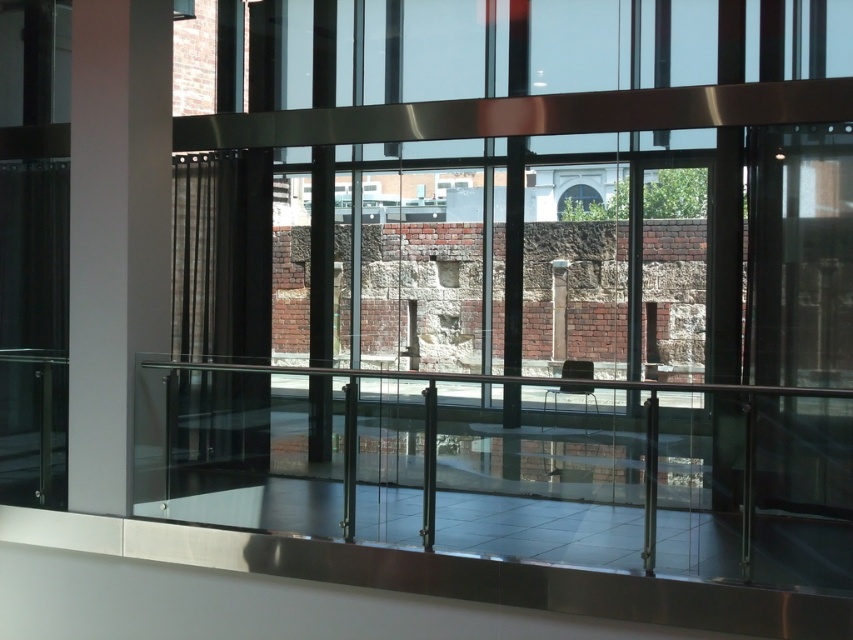
Who is higher up, clear glass railing at center or white glossy pillar at left?

white glossy pillar at left is above.

Between point (840, 499) and point (93, 371), which one is positioned behind?

Positioned behind is point (840, 499).

Identify the location of clear glass railing at center. This screenshot has width=853, height=640. (509, 467).

Does white glossy pillar at left have a smaller size compared to smooth stone pillar at center?

Actually, white glossy pillar at left might be larger than smooth stone pillar at center.

Who is lower down, white glossy pillar at left or smooth stone pillar at center?

smooth stone pillar at center

Locate an element on the screen. white glossy pillar at left is located at coordinates (115, 234).

Is the position of clear glass railing at center more distant than that of smooth stone pillar at center?

No, it is in front of smooth stone pillar at center.

Between point (386, 477) and point (554, 340), which one is positioned in front?

Point (386, 477)

You are a GUI agent. You are given a task and a screenshot of the screen. Output one action in this format:
    pyautogui.click(x=<x>, y=<y>)
    Task: Click on the clear glass railing at center
    This screenshot has height=640, width=853.
    Given the screenshot: What is the action you would take?
    pyautogui.click(x=509, y=467)